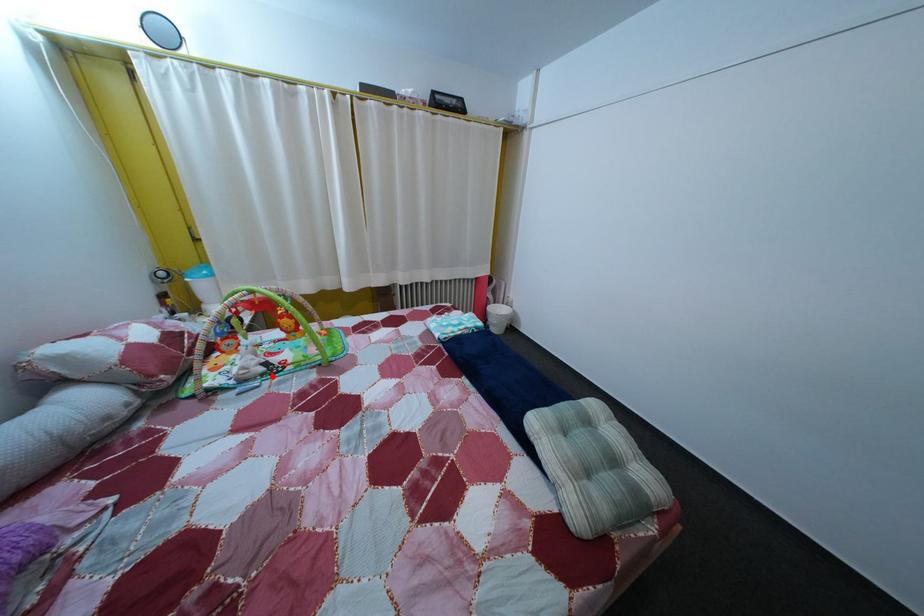
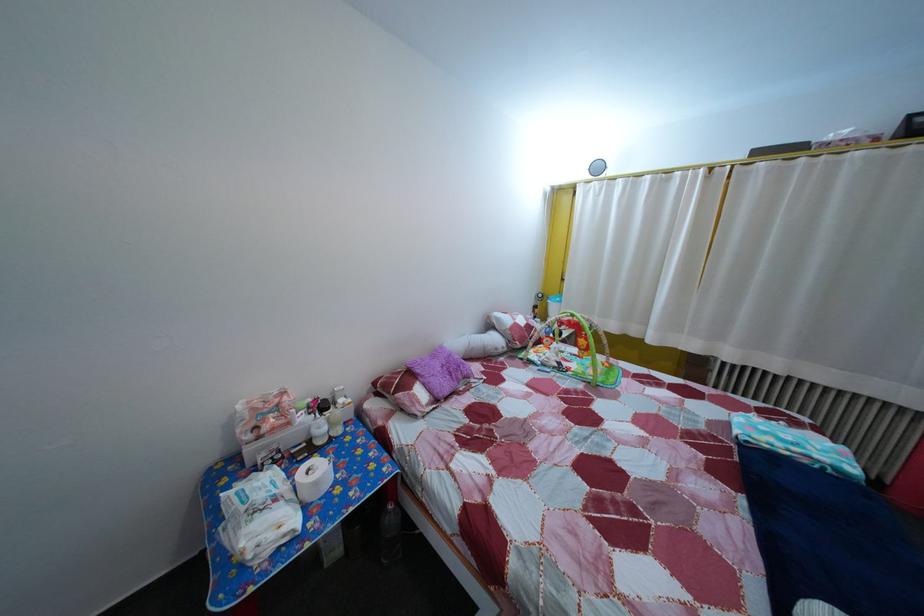
Find the pixel in the second image that matches the highlighted location in the first image.

(565, 371)